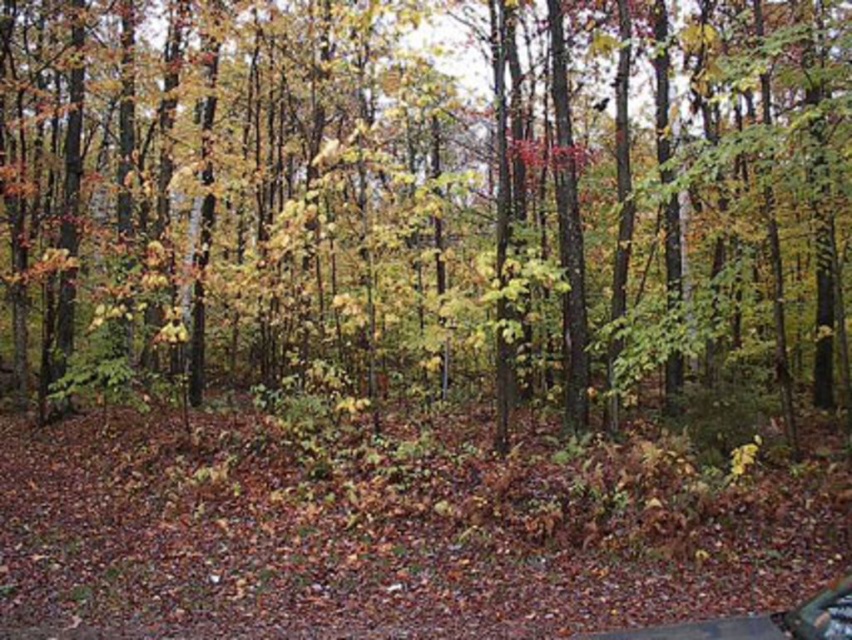
Describe the element at coordinates (429, 202) in the screenshot. I see `green matte tree at center` at that location.

Does green matte tree at center have a greater height compared to metallic silver car at lower right?

Yes.

Identify the location of green matte tree at center. The image size is (852, 640). (429, 202).